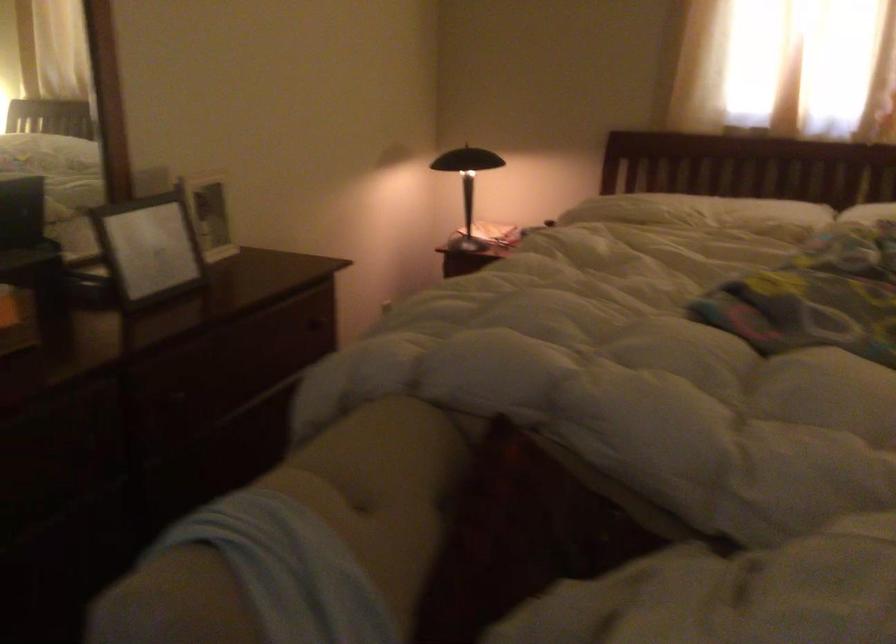
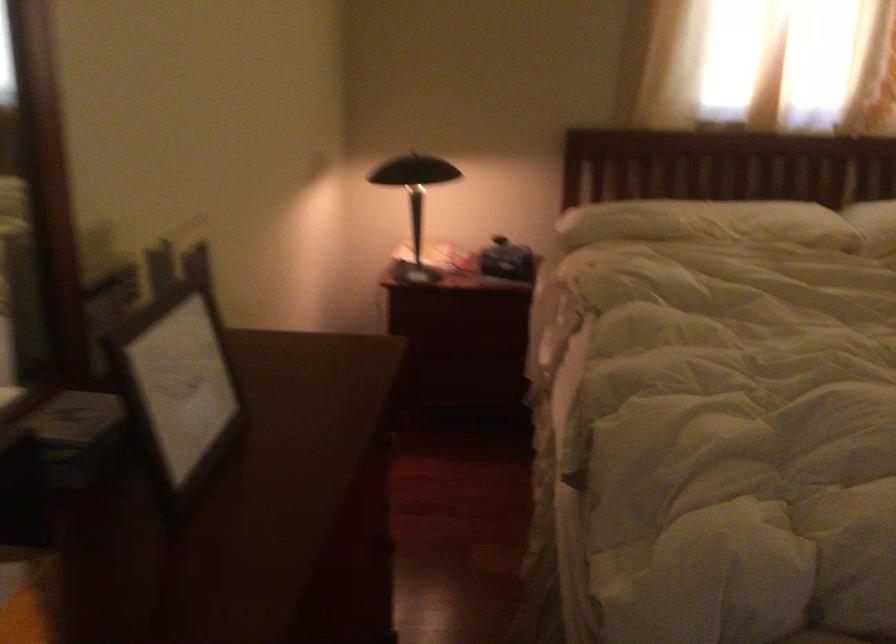
Locate, in the second image, the point that corresponds to point 139,248 in the first image.

(177, 386)